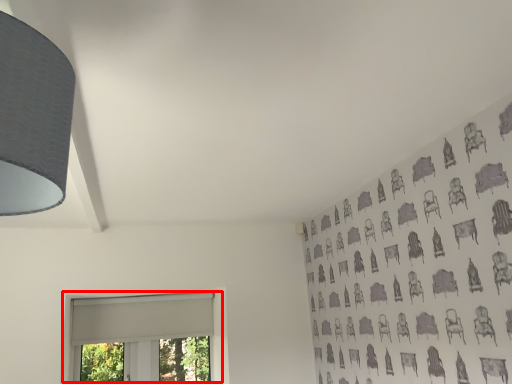
Question: In this image, where is window (annotated by the red box) located relative to lamp?

Choices:
 (A) right
 (B) left

Answer: (B)